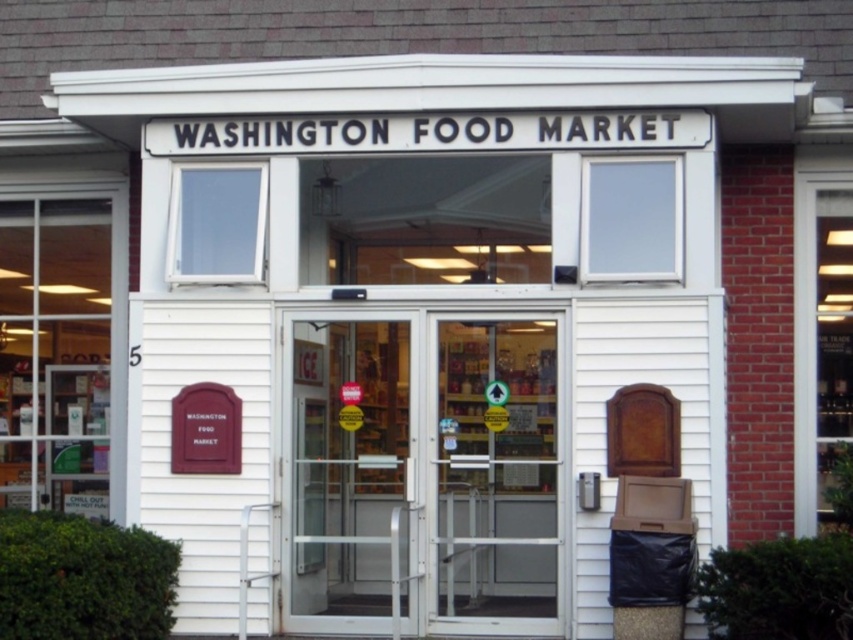
Between transparent glass doors at center and transparent glass door at center, which one has less height?

transparent glass door at center

In the scene shown: Between transparent glass doors at center and transparent glass door at center, which one is positioned lower?

transparent glass door at center

The height and width of the screenshot is (640, 853). What do you see at coordinates (426, 472) in the screenshot?
I see `transparent glass doors at center` at bounding box center [426, 472].

Locate an element on the screen. transparent glass doors at center is located at coordinates (426, 472).

Is point (436, 602) behind point (451, 387)?

No, it is in front of (451, 387).

Who is more forward, [339,588] or [492,353]?

Point [492,353]

Where is `transparent glass doors at center`? transparent glass doors at center is located at coordinates (426, 472).

Is transparent glass door at center behind clear glass door at center?

No, it is in front of clear glass door at center.

Who is more forward, (294, 333) or (466, 484)?

Point (294, 333)

Who is more forward, (349, 484) or (550, 600)?

Point (550, 600) is more forward.

At what (x,y) coordinates should I click in order to perform the action: click on transparent glass door at center. Please return your answer as a coordinate pair (x, y). The height and width of the screenshot is (640, 853). Looking at the image, I should click on (351, 472).